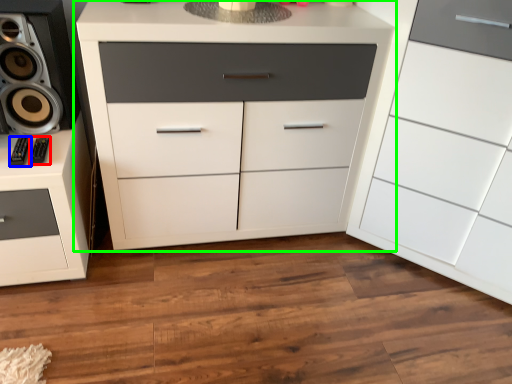
Question: Which is farther away from audio (highlighted by a red box)? audio (highlighted by a blue box) or chest of drawers (highlighted by a green box)?

Choices:
 (A) audio
 (B) chest of drawers

Answer: (B)